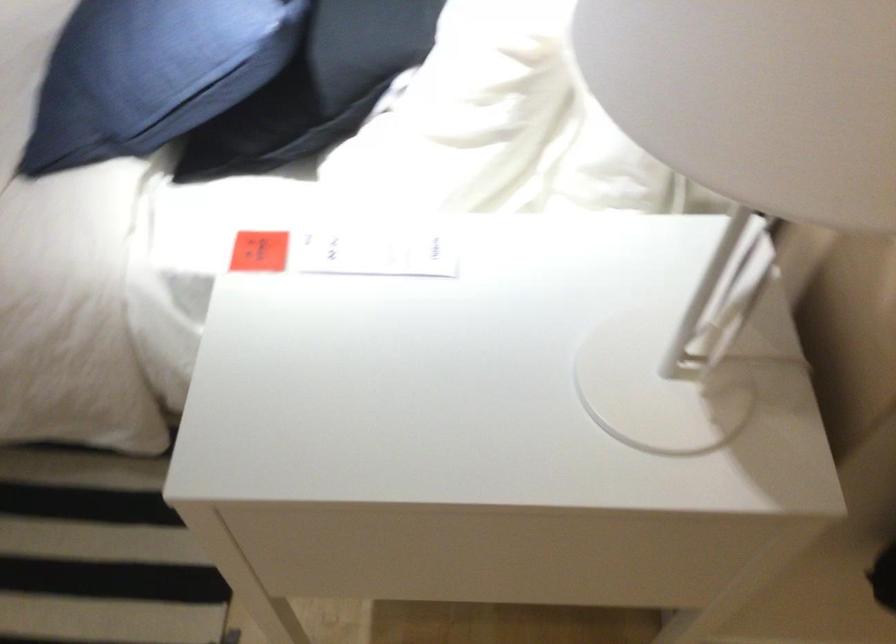
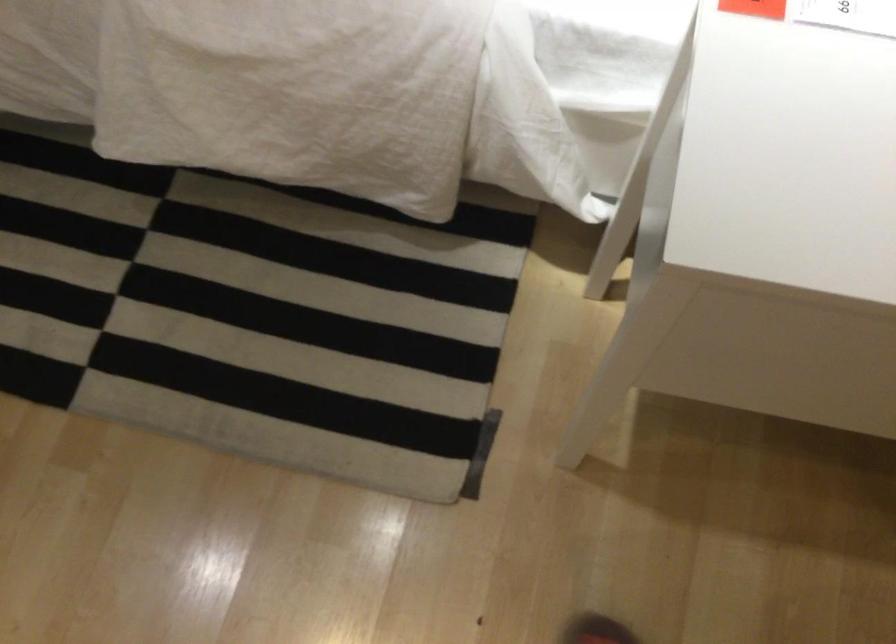
The point at (x=263, y=269) is marked in the first image. Where is the corresponding point in the second image?

(754, 8)